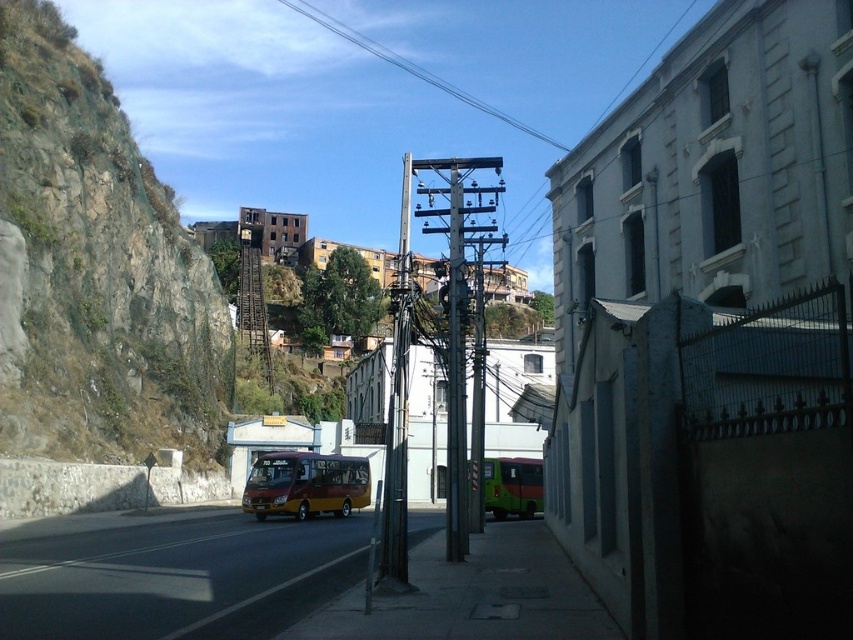
You are standing at the bus stop on the sidewalk and see two points marked on the road ahead. The first point is labeled as point (454,554) and the second as point (325,509). Which point is closer to you?

Point (454,554) is in front of point (325,509), so it is closer to you.

You are a delivery person trying to avoid hitting overhead wires while driving a truck that is 3 meters tall. You see the metallic gray telegraph pole at center and the clear wire at upper center in your path. Which object do you need to be more cautious about in terms of height?

The metallic gray telegraph pole at center has a greater height compared to the clear wire at upper center, so you should be more cautious about the metallic gray telegraph pole at center to avoid hitting it with your 3 meters tall truck.

You are standing on the road and want to cross to the building on the right. The concrete sidewalk at center is located at point (474, 595). Can you walk directly to the building on the right from your current position without stepping off the road?

The concrete sidewalk at center is located at point (474, 595), so yes, you can walk directly to the building on the right from your current position by following the sidewalk at that coordinate.